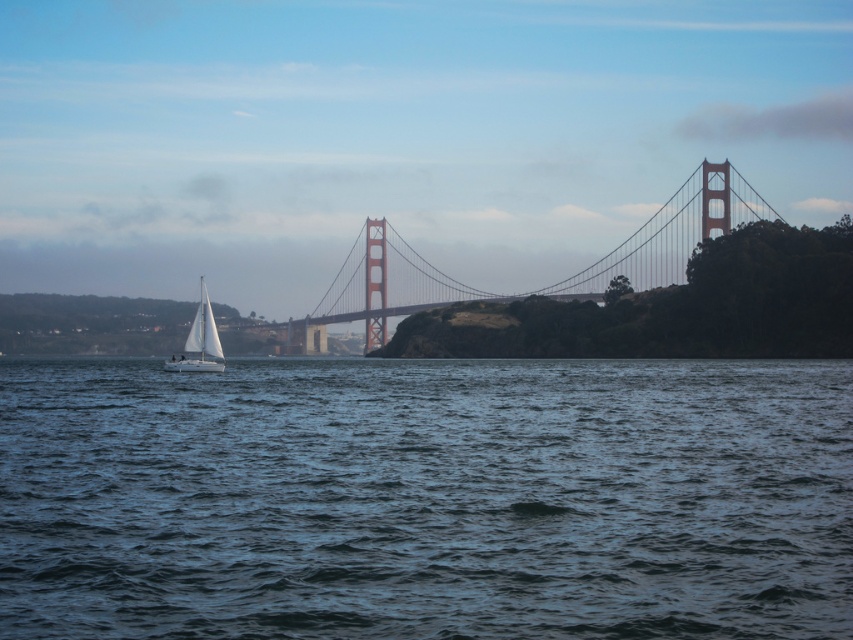
Question: Which object is positioned farthest from the white matte sailboat at left?

Choices:
 (A) dark blue water at center
 (B) metallic suspension bridge at center

Answer: (B)

Question: Which object is positioned closest to the white matte sailboat at left?

Choices:
 (A) metallic suspension bridge at center
 (B) dark blue water at center

Answer: (B)

Question: Which of the following is the farthest from the observer?

Choices:
 (A) white matte sailboat at left
 (B) dark blue water at center

Answer: (A)

Question: Is dark blue water at center to the left of metallic suspension bridge at center from the viewer's perspective?

Choices:
 (A) no
 (B) yes

Answer: (B)

Question: Can you confirm if dark blue water at center is thinner than metallic suspension bridge at center?

Choices:
 (A) no
 (B) yes

Answer: (A)

Question: Is dark blue water at center below white matte sailboat at left?

Choices:
 (A) yes
 (B) no

Answer: (A)